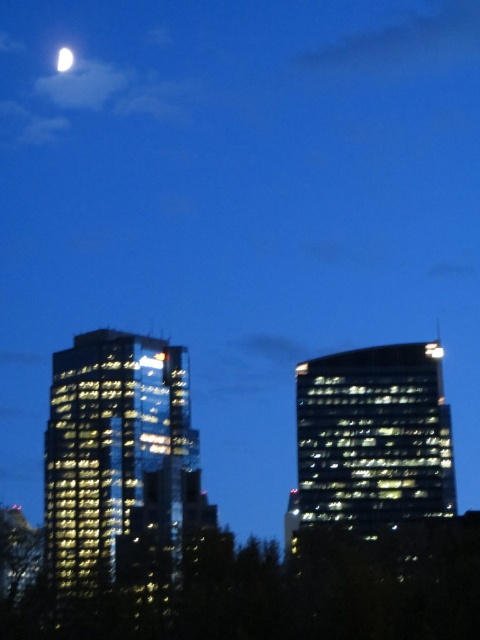
Question: Can you confirm if glossy glass skyscraper at right is positioned below white glossy moon at upper left?

Choices:
 (A) yes
 (B) no

Answer: (A)

Question: Which of the following is the farthest from the observer?

Choices:
 (A) glossy glass skyscraper at right
 (B) glossy glass building at left

Answer: (A)

Question: Which object is the farthest from the glossy glass building at left?

Choices:
 (A) glossy glass skyscraper at right
 (B) white glossy moon at upper left

Answer: (B)

Question: Among these objects, which one is nearest to the camera?

Choices:
 (A) glossy glass building at left
 (B) white glossy moon at upper left
 (C) glossy glass skyscraper at right

Answer: (A)

Question: Is glossy glass building at left to the left of white glossy moon at upper left from the viewer's perspective?

Choices:
 (A) yes
 (B) no

Answer: (B)

Question: Is glossy glass building at left smaller than white glossy moon at upper left?

Choices:
 (A) no
 (B) yes

Answer: (A)